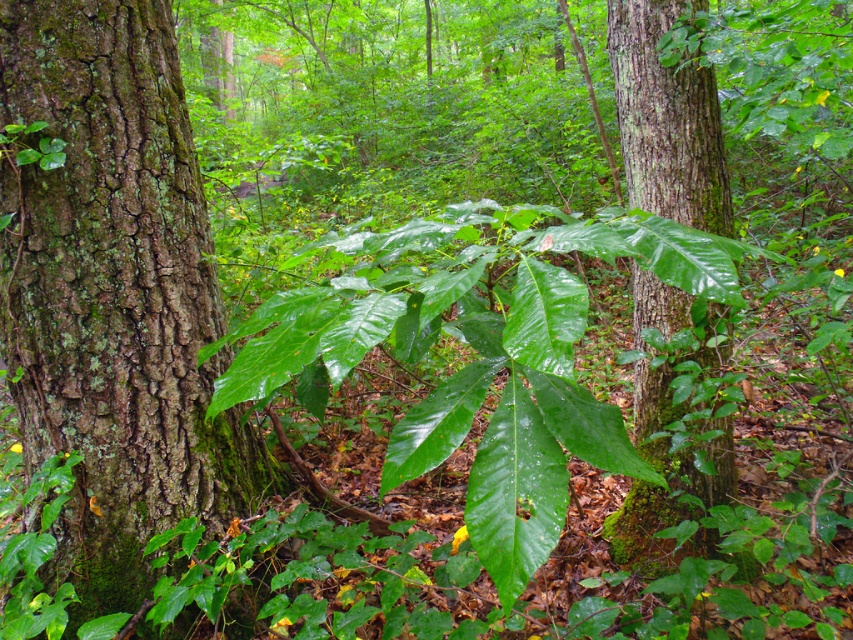
Between point (238, 442) and point (645, 300), which one is positioned in front?

Positioned in front is point (238, 442).

Can you confirm if green mossy bark at center is taller than green leafy tree at center?

In fact, green mossy bark at center may be shorter than green leafy tree at center.

Does point (228, 440) lie in front of point (618, 16)?

Yes, it is.

Where is `green mossy bark at center`? The image size is (853, 640). green mossy bark at center is located at coordinates (113, 291).